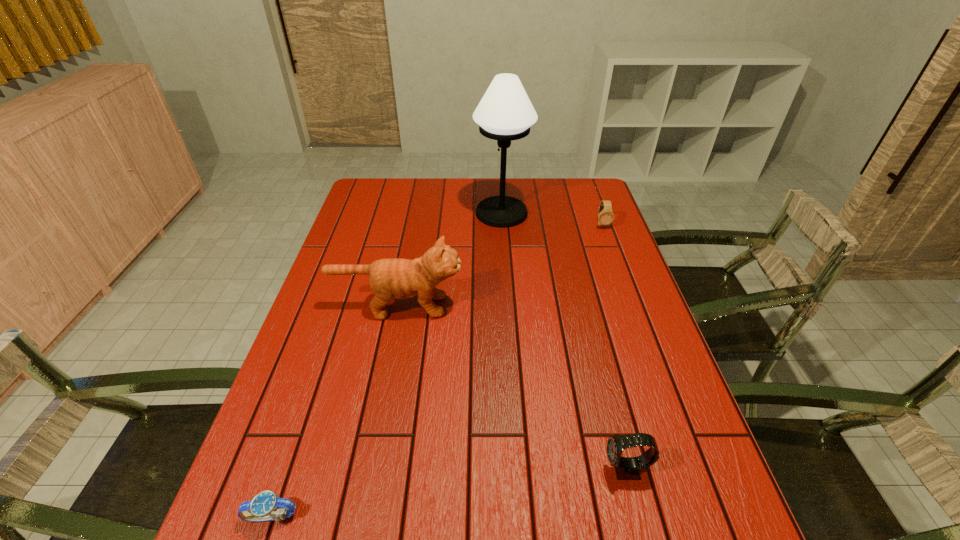
Where is `the third object from left to right`? the third object from left to right is located at coordinates (505, 113).

Image resolution: width=960 pixels, height=540 pixels. What are the coordinates of `table lamp` in the screenshot? It's located at (505, 113).

In order to click on cat in this screenshot , I will do `click(396, 278)`.

Identify the location of the third farthest object. (396, 278).

At what (x,y) coordinates should I click in order to perform the action: click on the tallest watch. Please return your answer as a coordinate pair (x, y). The image size is (960, 540). Looking at the image, I should click on (626, 468).

This screenshot has width=960, height=540. Identify the location of the second object from right to left. (626, 468).

Locate an element on the screen. This screenshot has width=960, height=540. the rightmost watch is located at coordinates [x=606, y=216].

Where is `the second shortest watch`? The height and width of the screenshot is (540, 960). the second shortest watch is located at coordinates (606, 216).

The width and height of the screenshot is (960, 540). What are the coordinates of `the nearest object` in the screenshot? It's located at (260, 508).

The height and width of the screenshot is (540, 960). I want to click on the shortest object, so click(260, 508).